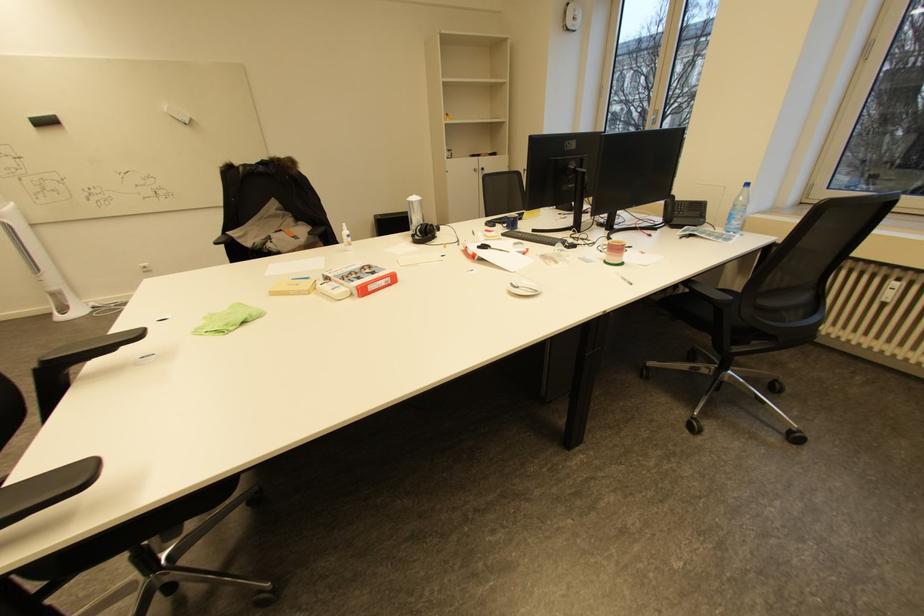
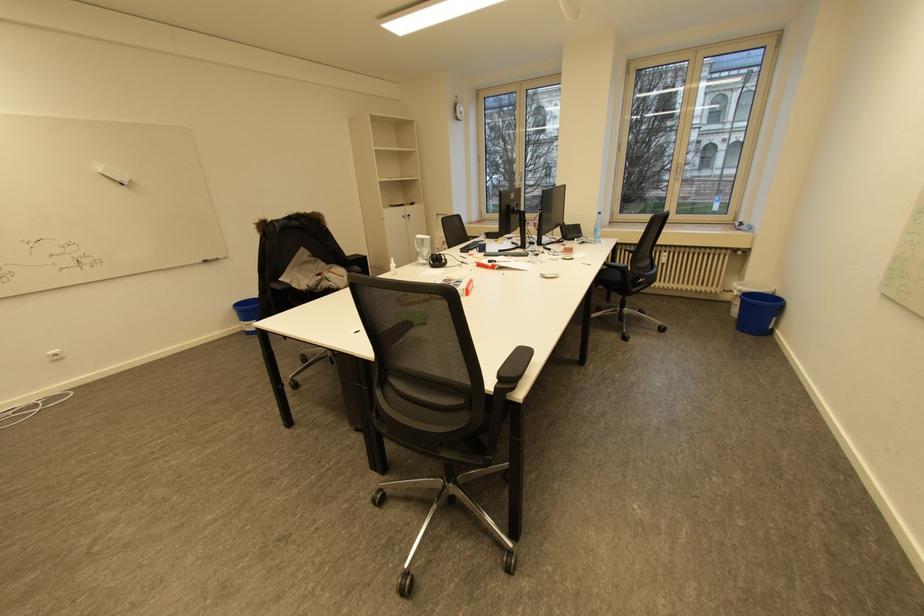
Locate, in the second image, the point that corresponds to (736,215) in the first image.

(601, 230)